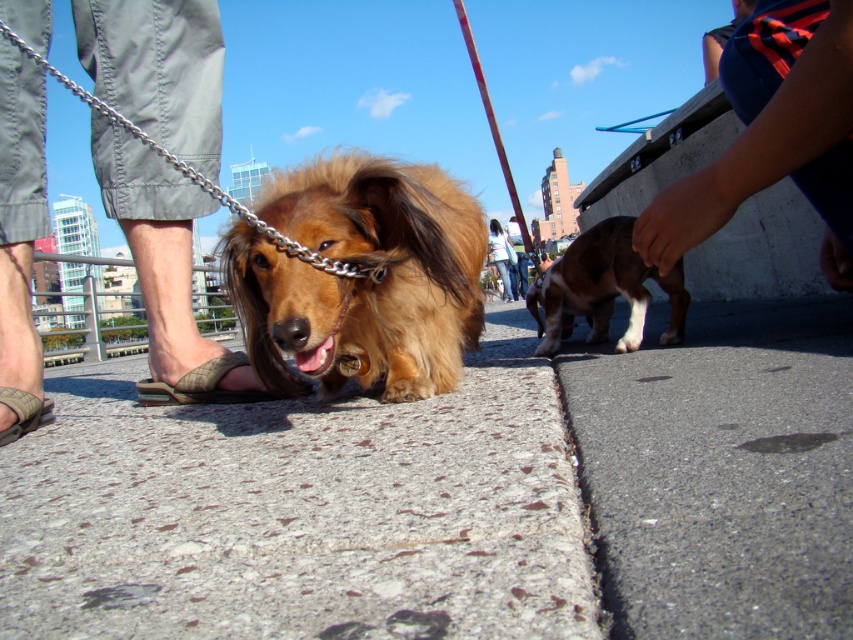
Is shiny brown fur at center closer to camera compared to denim pants at center?

Yes, it is.

Describe the element at coordinates (361, 278) in the screenshot. The width and height of the screenshot is (853, 640). I see `shiny brown fur at center` at that location.

Locate an element on the screen. Image resolution: width=853 pixels, height=640 pixels. shiny brown fur at center is located at coordinates (361, 278).

Can you confirm if gray fabric pants at left is positioned to the left of brown and white fur at right?

Yes, gray fabric pants at left is to the left of brown and white fur at right.

This screenshot has width=853, height=640. Describe the element at coordinates (165, 269) in the screenshot. I see `gray fabric pants at left` at that location.

Is point (157, 84) more distant than point (592, 282)?

No, it is not.

Identify the location of gray fabric pants at left. (165, 269).

Does gray concrete curb at lower center appear on the right side of denim pants at center?

In fact, gray concrete curb at lower center is to the left of denim pants at center.

Between point (583, 496) and point (512, 298), which one is positioned behind?

The point (512, 298) is more distant.

Find the location of a particular element. This screenshot has width=853, height=640. gray concrete curb at lower center is located at coordinates (587, 513).